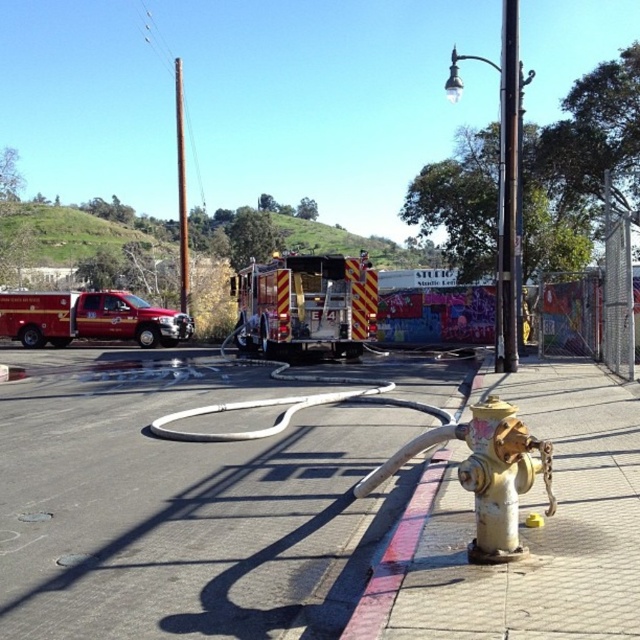
Does yellow painted metal hydrant at lower right come behind dark brown metal pole at upper right?

No, yellow painted metal hydrant at lower right is closer to the viewer.

Between point (440, 564) and point (508, 195), which one is positioned in front?

Positioned in front is point (440, 564).

At what (x,y) coordinates should I click in order to perform the action: click on yellow painted metal hydrant at lower right. Please return your answer as a coordinate pair (x, y). The image size is (640, 640). Looking at the image, I should click on (524, 529).

This screenshot has width=640, height=640. What are the coordinates of `dark brown metal pole at upper right` in the screenshot? It's located at (508, 193).

Consider the image. Can you confirm if dark brown metal pole at upper right is bigger than brushed metal pole at upper center?

Incorrect, dark brown metal pole at upper right is not larger than brushed metal pole at upper center.

Between point (513, 138) and point (173, 90), which one is positioned behind?

Point (173, 90)

The image size is (640, 640). I want to click on dark brown metal pole at upper right, so (508, 193).

Is point (369, 291) in front of point (72, 330)?

Yes, it is.

Who is more forward, [243,296] or [17,316]?

Point [243,296] is more forward.

Image resolution: width=640 pixels, height=640 pixels. Describe the element at coordinates (305, 304) in the screenshot. I see `reflective silver fire truck at center` at that location.

Identify the location of reflective silver fire truck at center. (305, 304).